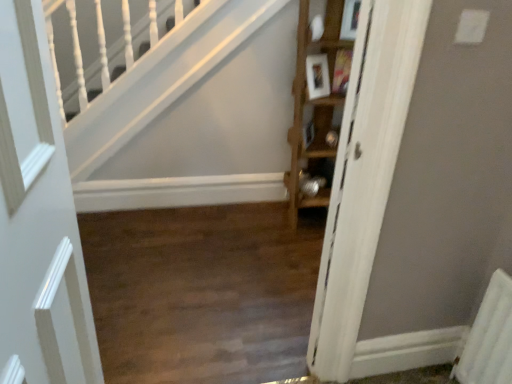
Question: In terms of size, does wooden floor at center appear bigger or smaller than wooden cabinet at right?

Choices:
 (A) big
 (B) small

Answer: (B)

Question: Considering their positions, is wooden floor at center located in front of or behind wooden cabinet at right?

Choices:
 (A) behind
 (B) front

Answer: (B)

Question: Estimate the real-world distances between objects in this image. Which object is closer to the wooden floor at center?

Choices:
 (A) wooden cabinet at right
 (B) white matte door at left

Answer: (A)

Question: Based on their relative distances, which object is farther from the wooden cabinet at right?

Choices:
 (A) wooden floor at center
 (B) white matte door at left

Answer: (B)